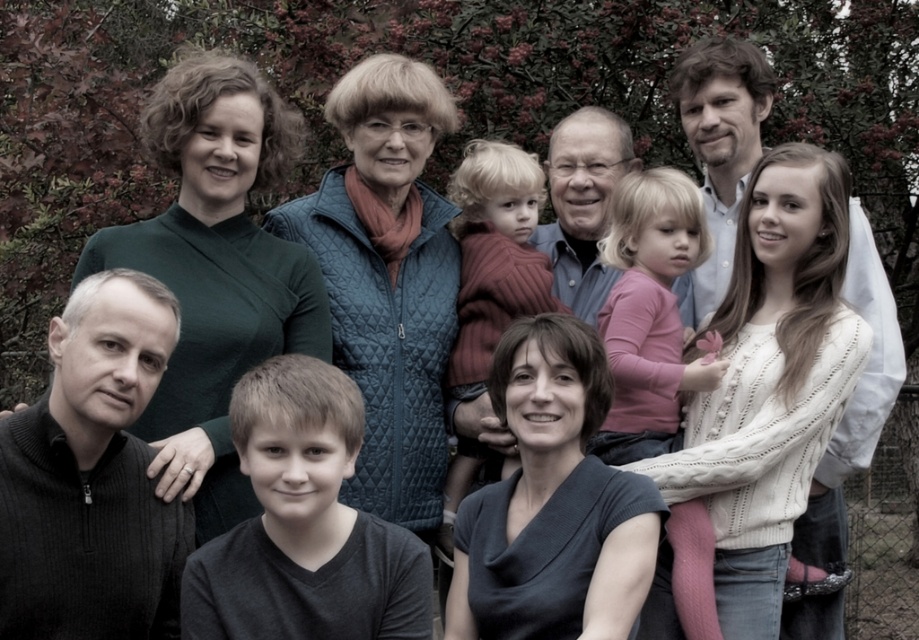
Question: Does dark gray v-neck shirt at lower left lie behind pink sweater at center?

Choices:
 (A) no
 (B) yes

Answer: (A)

Question: Considering the real-world distances, which object is closest to the maroon knitted sweater at center?

Choices:
 (A) pink sweater at center
 (B) dark gray v-neck shirt at lower left

Answer: (A)

Question: Among these points, which one is nearest to the camera?

Choices:
 (A) (611, 198)
 (B) (396, 572)

Answer: (B)

Question: Among these objects, which one is nearest to the camera?

Choices:
 (A) pink sweater at center
 (B) dark gray v-neck shirt at lower left
 (C) maroon knitted sweater at center

Answer: (B)

Question: Does dark gray v-neck shirt at lower left appear over pink sweater at center?

Choices:
 (A) no
 (B) yes

Answer: (A)

Question: Is pink sweater at center in front of maroon knitted sweater at center?

Choices:
 (A) no
 (B) yes

Answer: (B)